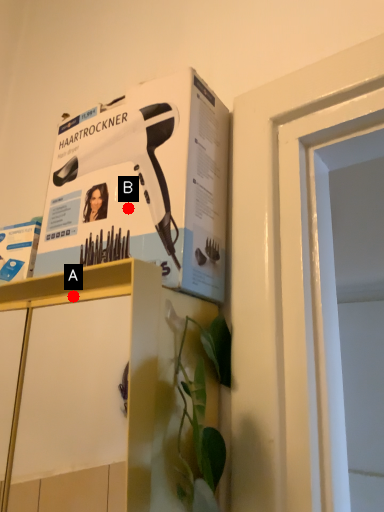
Question: Two points are circled on the image, labeled by A and B beside each circle. Which point appears farthest from the camera in this image?

Choices:
 (A) A is further
 (B) B is further

Answer: (B)